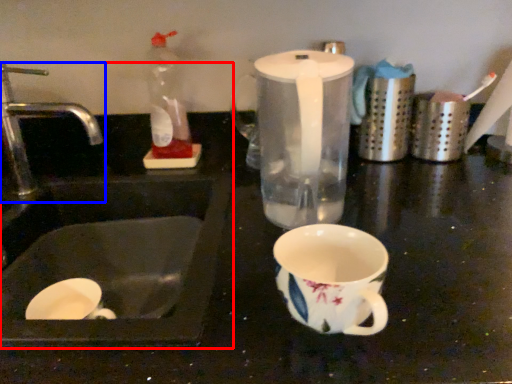
Question: Which object is closer to the camera taking this photo, sink (highlighted by a red box) or tap (highlighted by a blue box)?

Choices:
 (A) sink
 (B) tap

Answer: (A)